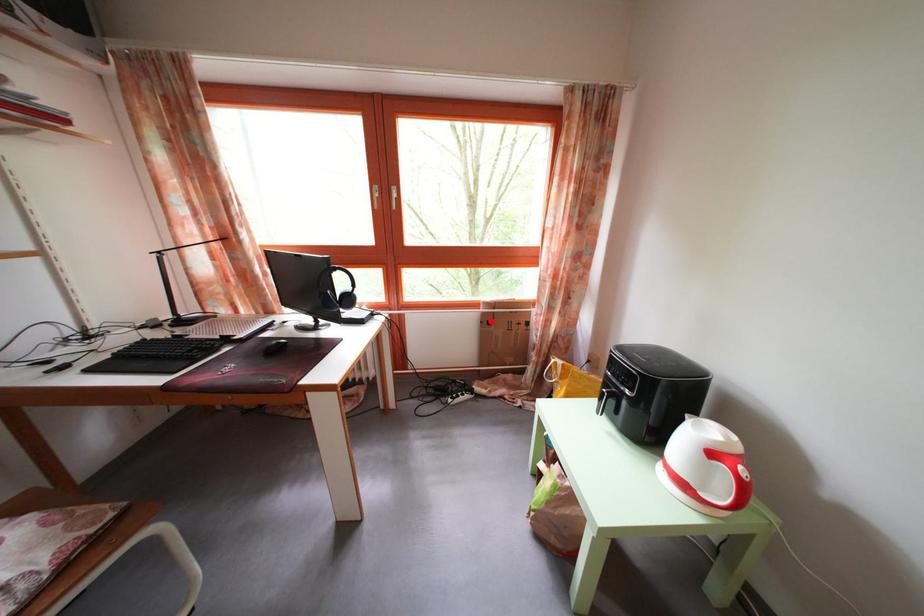
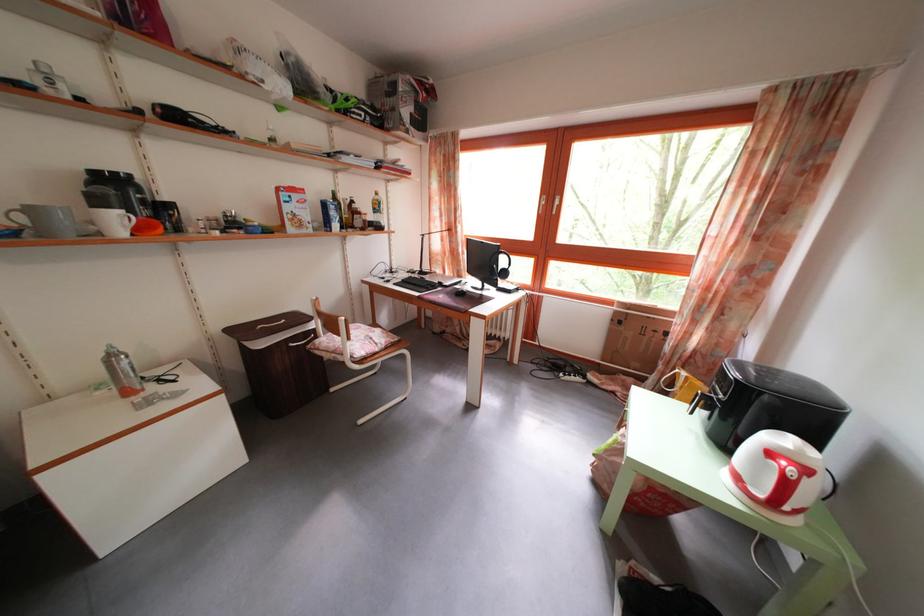
Locate, in the second image, the point that corresponds to the highlighted location in the first image.

(623, 320)